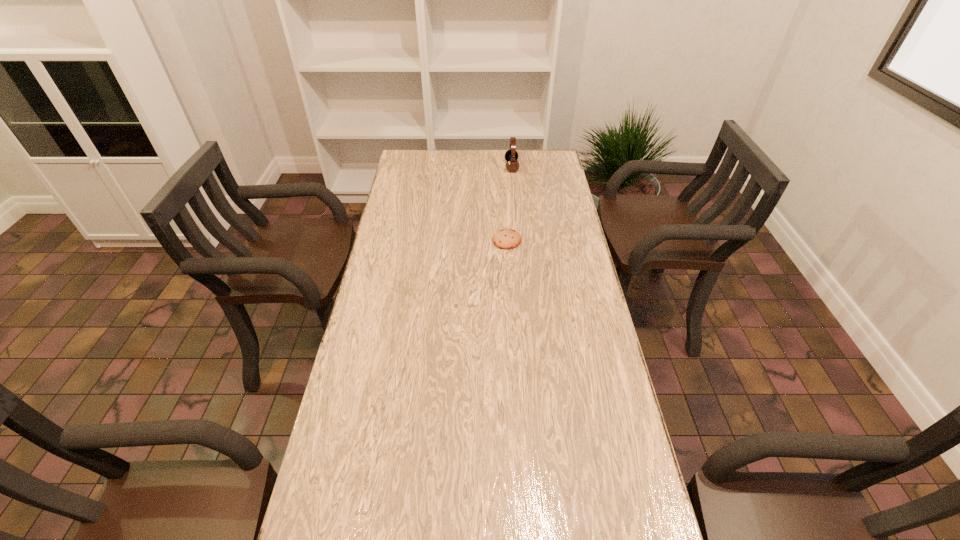
I want to click on the farther object, so click(511, 155).

Where is `the taller object`? the taller object is located at coordinates (511, 155).

Image resolution: width=960 pixels, height=540 pixels. I want to click on the shorter object, so click(505, 239).

Where is `the nearer object`? Image resolution: width=960 pixels, height=540 pixels. the nearer object is located at coordinates (505, 239).

Identify the location of vacant space situated 0.180m on the ear pads of the taller object. (465, 167).

The width and height of the screenshot is (960, 540). Find the location of `free space located on the ear pads of the taller object`. free space located on the ear pads of the taller object is located at coordinates (456, 167).

Image resolution: width=960 pixels, height=540 pixels. Identify the location of free space located on the ear pads of the taller object. (478, 167).

You are a GUI agent. You are given a task and a screenshot of the screen. Output one action in this format:
    pyautogui.click(x=<x>, y=<y>)
    Task: Click on the free space located on the left of the cookie
    This screenshot has width=960, height=540.
    Given the screenshot: What is the action you would take?
    pyautogui.click(x=436, y=240)

I want to click on object at the far edge, so click(511, 155).

The height and width of the screenshot is (540, 960). In the image, there is a desktop. In order to click on vacant space at the far edge in this screenshot , I will do `click(489, 163)`.